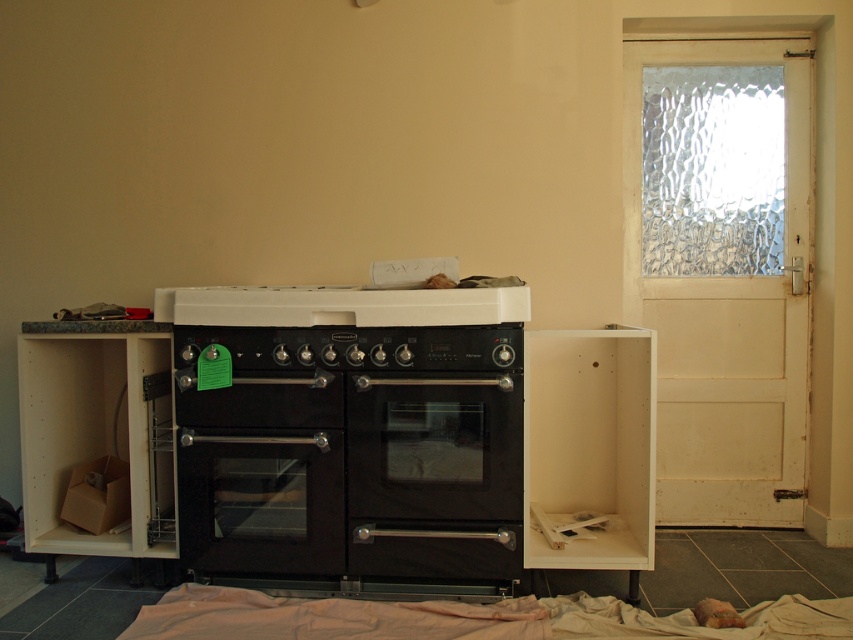
You are a technician installing a kitchen appliance. You need to access both the black matte oven at center and the black matte stove at center. Since they are both at the center, which one is closer to you?

The black matte oven at center is closer to you because the black matte stove at center is behind it.

You are a home renovator who needs to install a new black matte oven at center and a black matte stove at center into a kitchen. According to the space provided, which appliance takes up more floor space?

The black matte oven at center is bigger than the black matte stove at center, so the oven takes up more floor space.

You are a technician installing a new kitchen appliance and need to ensure proper spacing between the black matte oven at center and the black matte stove at center. According to the manufacturer guidelines, they must be at least 12 inches apart for safety. Is the current distance sufficient?

The black matte oven at center is 11.75 inches away from the black matte stove at center, which is less than the required 12 inches. Therefore, the current distance is insufficient and does not meet the safety guidelines.